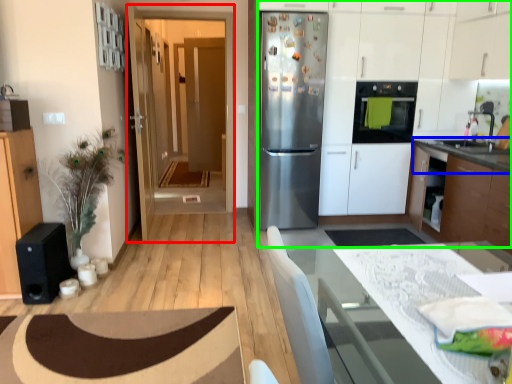
Question: Which object is positioned closest to glass door (highlighted by a red box)? Select from countertop (highlighted by a blue box) and dresser (highlighted by a green box).

Choices:
 (A) countertop
 (B) dresser

Answer: (B)